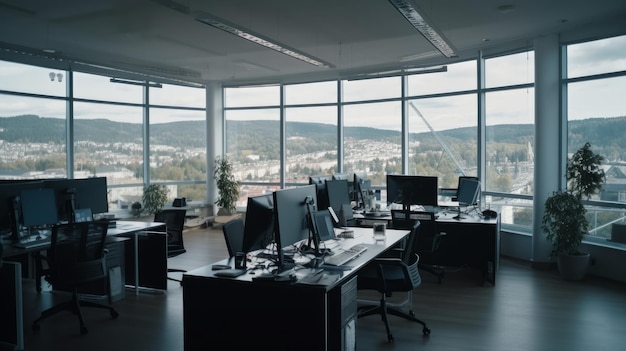
This screenshot has width=626, height=351. Identify the location of chair back in front of window. (470, 184), (466, 192).